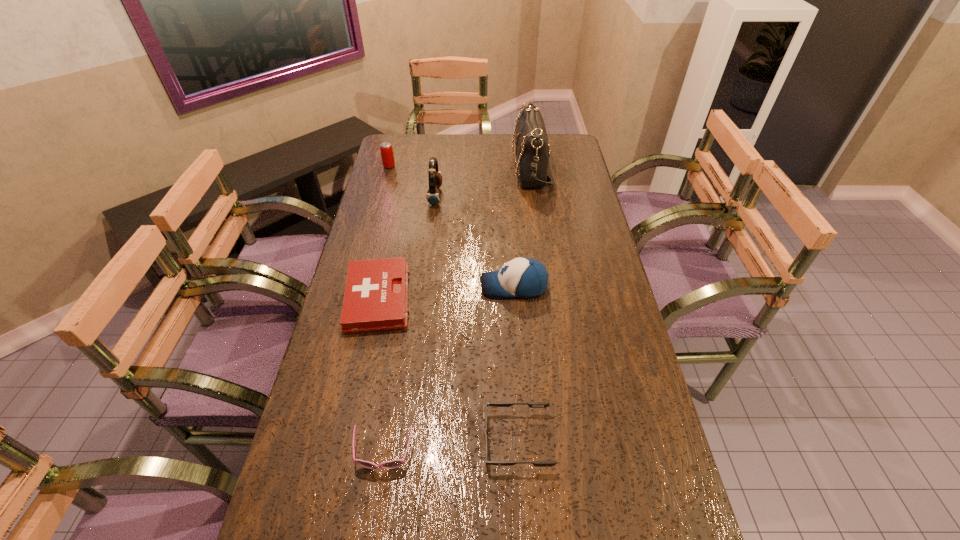
Where is `the tallest object`? This screenshot has width=960, height=540. the tallest object is located at coordinates (532, 151).

This screenshot has height=540, width=960. In order to click on headset in this screenshot , I will do `click(433, 197)`.

You are a GUI agent. You are given a task and a screenshot of the screen. Output one action in this format:
    pyautogui.click(x=<x>, y=<y>)
    Task: Click on the baseball cap
    This screenshot has width=960, height=540.
    Given the screenshot: What is the action you would take?
    pyautogui.click(x=522, y=277)

Locate an element on the screen. The height and width of the screenshot is (540, 960). beer can is located at coordinates (386, 149).

At what (x,y) coordinates should I click in order to perform the action: click on the first-aid kit. Please return your answer as a coordinate pair (x, y). Looking at the image, I should click on (376, 293).

Locate an element on the screen. the left sunglasses is located at coordinates click(x=396, y=463).

Where is `the right sunglasses`? Image resolution: width=960 pixels, height=540 pixels. the right sunglasses is located at coordinates (497, 404).

Find the location of a particular element. Image resolution: width=960 pixels, height=540 pixels. vacant space positioned at the front of the handbag with chain and zipper is located at coordinates (420, 169).

Find the location of a particular element. This screenshot has height=540, width=960. vacant space located 0.230m at the front of the handbag with chain and zipper is located at coordinates (456, 169).

Find the location of `free space located at the front of the handbag with chain and zipper`. free space located at the front of the handbag with chain and zipper is located at coordinates [461, 169].